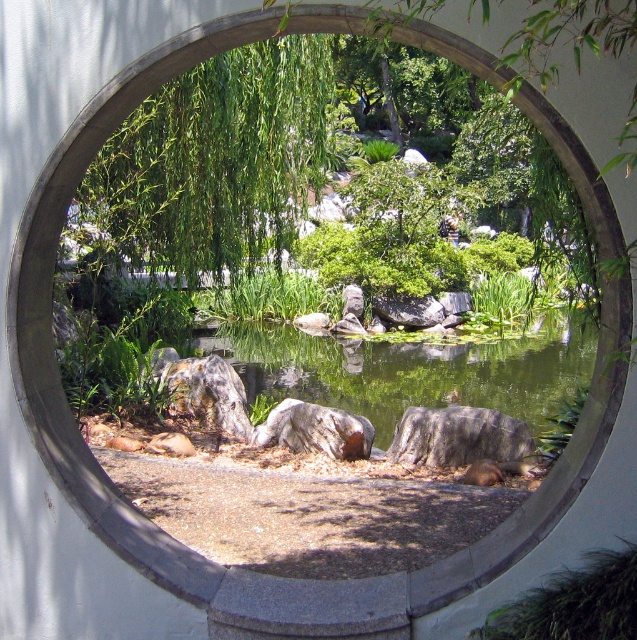
Question: Does green leafy tree at upper left have a larger size compared to gray rough rock at center?

Choices:
 (A) no
 (B) yes

Answer: (B)

Question: Among these objects, which one is nearest to the camera?

Choices:
 (A) gray rough rock at center
 (B) green leafy tree at upper left

Answer: (B)

Question: Considering the relative positions of green leafy tree at upper left and gray rough rock at center in the image provided, where is green leafy tree at upper left located with respect to gray rough rock at center?

Choices:
 (A) right
 (B) left

Answer: (B)

Question: Which object appears farthest from the camera in this image?

Choices:
 (A) gray rough rock at center
 (B) green leafy tree at upper left

Answer: (A)

Question: Can you confirm if green leafy tree at upper left is positioned to the right of gray rough rock at center?

Choices:
 (A) no
 (B) yes

Answer: (A)